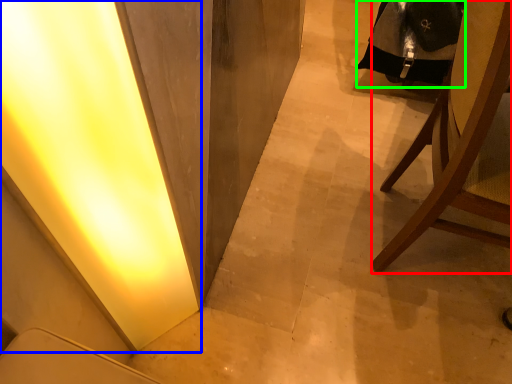
Question: Which object is the farthest from chair (highlighted by a red box)? Choose among these: light (highlighted by a blue box) or robe (highlighted by a green box).

Choices:
 (A) light
 (B) robe

Answer: (A)